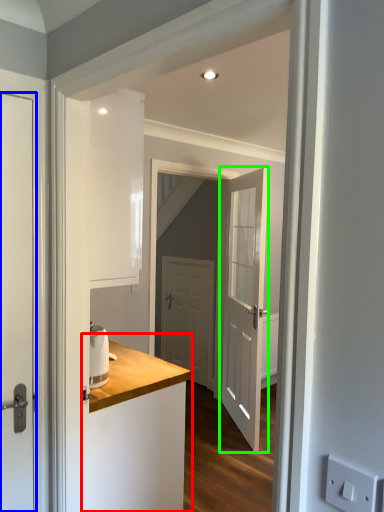
Question: Which object is the farthest from counter (highlighted by a red box)? Choose among these: door (highlighted by a blue box) or door (highlighted by a green box).

Choices:
 (A) door
 (B) door

Answer: (B)